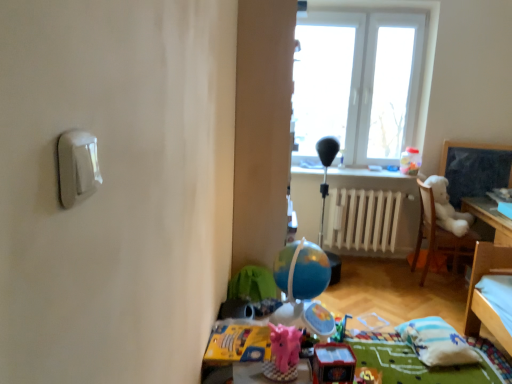
Question: Considering the relative positions of white painted metal radiator at center and translucent plastic container at upper right, placed as the 1th toy when sorted from top to bottom, in the image provided, is white painted metal radiator at center in front of translucent plastic container at upper right, placed as the 1th toy when sorted from top to bottom,?

Choices:
 (A) yes
 (B) no

Answer: (B)

Question: From the image's perspective, is white painted metal radiator at center on top of translucent plastic container at upper right, placed as the 1th toy when sorted from top to bottom?

Choices:
 (A) no
 (B) yes

Answer: (A)

Question: Considering the relative sizes of white painted metal radiator at center and translucent plastic container at upper right, placed as the 1th toy when sorted from back to front, in the image provided, is white painted metal radiator at center thinner than translucent plastic container at upper right, placed as the 1th toy when sorted from back to front,?

Choices:
 (A) yes
 (B) no

Answer: (A)

Question: Does white painted metal radiator at center have a smaller size compared to translucent plastic container at upper right, positioned as the third toy in front-to-back order?

Choices:
 (A) yes
 (B) no

Answer: (B)

Question: Does white painted metal radiator at center lie behind translucent plastic container at upper right, positioned as the third toy in front-to-back order?

Choices:
 (A) yes
 (B) no

Answer: (A)

Question: Is white painted metal radiator at center inside the boundaries of white plastic light switch at upper left, or outside?

Choices:
 (A) outside
 (B) inside

Answer: (A)

Question: Considering the positions of point (342, 200) and point (94, 177), is point (342, 200) closer or farther from the camera than point (94, 177)?

Choices:
 (A) farther
 (B) closer

Answer: (A)

Question: Is white painted metal radiator at center bigger or smaller than white plastic light switch at upper left?

Choices:
 (A) small
 (B) big

Answer: (B)

Question: Based on their positions, is white painted metal radiator at center located to the left or right of white plastic light switch at upper left?

Choices:
 (A) right
 (B) left

Answer: (A)

Question: Is white soft pillow at lower right wider or thinner than white plush bear at right?

Choices:
 (A) wide
 (B) thin

Answer: (B)

Question: Considering the positions of white soft pillow at lower right and white plush bear at right in the image, is white soft pillow at lower right bigger or smaller than white plush bear at right?

Choices:
 (A) big
 (B) small

Answer: (B)

Question: Do you think white soft pillow at lower right is within white plush bear at right, or outside of it?

Choices:
 (A) inside
 (B) outside

Answer: (B)

Question: Is point (421, 319) positioned closer to the camera than point (442, 220)?

Choices:
 (A) farther
 (B) closer

Answer: (B)

Question: Considering the positions of white plush bear at right and white painted metal radiator at center in the image, is white plush bear at right bigger or smaller than white painted metal radiator at center?

Choices:
 (A) big
 (B) small

Answer: (A)

Question: From the image's perspective, is white plush bear at right above or below white painted metal radiator at center?

Choices:
 (A) above
 (B) below

Answer: (A)